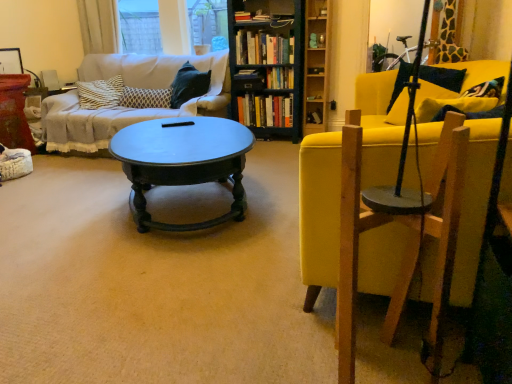
In order to face transparent glass window at upper center, should I rotate leftwards or rightwards?

Rotate your view left by about 10.457°.

What do you see at coordinates (140, 26) in the screenshot? Image resolution: width=512 pixels, height=384 pixels. I see `transparent glass window at upper center` at bounding box center [140, 26].

The height and width of the screenshot is (384, 512). Describe the element at coordinates (407, 242) in the screenshot. I see `wooden swivel chair at right` at that location.

What is the approximate height of wooden swivel chair at right?

wooden swivel chair at right is 30.66 inches in height.

Describe the element at coordinates (280, 78) in the screenshot. Image resolution: width=512 pixels, height=384 pixels. I see `hardcover book at center, which ranks as the fourth book in top-to-bottom order` at that location.

Locate an element on the screen. wooden bookshelf at center is located at coordinates (268, 66).

What do you see at coordinates (316, 65) in the screenshot? I see `wooden bookshelf at upper center` at bounding box center [316, 65].

The width and height of the screenshot is (512, 384). What are the coordinates of `wooden bookshelf at upper center` in the screenshot? It's located at (316, 65).

How much space does hardcover book at center, which appears as the second book when viewed from the top, occupy horizontally?

The width of hardcover book at center, which appears as the second book when viewed from the top, is 7.68 centimeters.

At what (x,y) coordinates should I click in order to perform the action: click on transparent glass window at upper center. Please return your answer as a coordinate pair (x, y). Looking at the image, I should click on (140, 26).

From a real-world perspective, is hardcover book at center, the 3th book ordered from the bottom, physically located above or below hardcover book at center, which is the fifth book from bottom to top?

In terms of real-world spatial position, hardcover book at center, the 3th book ordered from the bottom, is below hardcover book at center, which is the fifth book from bottom to top.

From the image's perspective, is hardcover book at center, the 3th book ordered from the bottom, beneath hardcover book at center, which is the fifth book from bottom to top?

Yes.

Choose the correct answer: Is hardcover book at center, which ranks as the fourth book in top-to-bottom order, inside hardcover book at center, which appears as the second book when viewed from the top, or outside it?

hardcover book at center, which ranks as the fourth book in top-to-bottom order, exists outside the volume of hardcover book at center, which appears as the second book when viewed from the top.

Which of these two, hardcover book at center, which ranks as the fourth book in top-to-bottom order, or hardcover book at center, which is the fifth book from bottom to top, is smaller?

hardcover book at center, which is the fifth book from bottom to top.

Between hardcover books at center, which is the 2th book from bottom to top, and hardcover book at center, which ranks as the fourth book in top-to-bottom order, which one has less height?

Standing shorter between the two is hardcover book at center, which ranks as the fourth book in top-to-bottom order.

In terms of width, does hardcover books at center, which is the 2th book from bottom to top, look wider or thinner when compared to hardcover book at center, the 3th book ordered from the bottom?

Considering their sizes, hardcover books at center, which is the 2th book from bottom to top, looks broader than hardcover book at center, the 3th book ordered from the bottom.

Which object is positioned more to the left, hardcover books at center, which is counted as the 5th book, starting from the top, or hardcover book at center, the 3th book ordered from the bottom?

From the viewer's perspective, hardcover books at center, which is counted as the 5th book, starting from the top, appears more on the left side.

Considering the sizes of hardcover books at center, which is the 2th book from bottom to top, and hardcover book at center, which ranks as the fourth book in top-to-bottom order, in the image, is hardcover books at center, which is the 2th book from bottom to top, bigger or smaller than hardcover book at center, which ranks as the fourth book in top-to-bottom order,?

Clearly, hardcover books at center, which is the 2th book from bottom to top, is larger in size than hardcover book at center, which ranks as the fourth book in top-to-bottom order.

Is shiny dark wood coffee table at center a part of patterned fabric pillow at center-left?

No, shiny dark wood coffee table at center is located outside of patterned fabric pillow at center-left.

In the scene shown: Is patterned fabric pillow at center-left next to shiny dark wood coffee table at center and touching it?

No, patterned fabric pillow at center-left is not in contact with shiny dark wood coffee table at center.

Between patterned fabric pillow at center-left and shiny dark wood coffee table at center, which one has smaller size?

patterned fabric pillow at center-left is smaller.

Would you consider hardcover book at center, which appears as the second book when viewed from the top, to be distant from wooden bookshelf at upper center?

No, hardcover book at center, which appears as the second book when viewed from the top, is not far from wooden bookshelf at upper center.

Which point is more distant from viewer, (314, 70) or (323, 86)?

Point (323, 86)

Considering the relative sizes of hardcover book at center, which appears as the second book when viewed from the top, and wooden bookshelf at upper center in the image provided, is hardcover book at center, which appears as the second book when viewed from the top, taller than wooden bookshelf at upper center?

No.

Is hardcover books at center, which is counted as the 6th book, starting from the bottom, facing towards white fabric curtain at upper left?

No, hardcover books at center, which is counted as the 6th book, starting from the bottom, is not aimed at white fabric curtain at upper left.

Between hardcover books at center, the first book from the top, and white fabric curtain at upper left, which one is positioned in front?

hardcover books at center, the first book from the top.

In the scene shown: Is hardcover books at center, the first book from the top, to the left of white fabric curtain at upper left from the viewer's perspective?

No.

Who is smaller, hardcover books at center, the first book from the top, or white fabric curtain at upper left?

Smaller between the two is hardcover books at center, the first book from the top.

Is hardcover books at center, which is the 2th book from bottom to top, at the right side of wooden bookshelf at center?

Incorrect, hardcover books at center, which is the 2th book from bottom to top, is not on the right side of wooden bookshelf at center.

Based on their sizes in the image, would you say hardcover books at center, which is the 2th book from bottom to top, is bigger or smaller than wooden bookshelf at center?

Clearly, hardcover books at center, which is the 2th book from bottom to top, is smaller in size than wooden bookshelf at center.

Identify the location of bookcase to the right of hardcover books at center, which is counted as the 5th book, starting from the top. (268, 66).

Would you say hardcover books at center, which is counted as the 5th book, starting from the top, is outside wooden bookshelf at center?

No, hardcover books at center, which is counted as the 5th book, starting from the top, is not outside of wooden bookshelf at center.

Is shiny dark wood coffee table at center surrounding wooden swivel chair at right?

Actually, wooden swivel chair at right is outside shiny dark wood coffee table at center.

Measure the distance from shiny dark wood coffee table at center to wooden swivel chair at right.

shiny dark wood coffee table at center and wooden swivel chair at right are 1.24 meters apart from each other.

Between shiny dark wood coffee table at center and wooden swivel chair at right, which one has less height?

shiny dark wood coffee table at center is shorter.

Can you confirm if shiny dark wood coffee table at center is bigger than wooden swivel chair at right?

Yes.

Locate an element on the screen. The width and height of the screenshot is (512, 384). book that is the 3rd object located in front of the hardcover book at center, which is the fifth book from bottom to top is located at coordinates (280, 78).

Identify the location of the 1st book to the right of the hardcover books at center, which is the 2th book from bottom to top, counting from the anchor's position. (280, 78).

From the picture: Looking at the image, which one is located closer to wooden bookshelf at upper center, velvet yellow chair at right or white fabric curtain at upper left?

Among the two, white fabric curtain at upper left is located nearer to wooden bookshelf at upper center.

Estimate the real-world distances between objects in this image. Which object is further from velvet yellow chair at right, wooden bookshelf at upper center or wooden bookshelf at center?

wooden bookshelf at upper center is positioned further to the anchor velvet yellow chair at right.

From the image, which object appears to be nearer to hardcover books at center, which is counted as the 5th book, starting from the top, white fabric curtain at upper left or hardcover books at center, the first book from the top?

Based on the image, hardcover books at center, the first book from the top, appears to be nearer to hardcover books at center, which is counted as the 5th book, starting from the top.

From the image, which object appears to be farther from transparent glass window at upper center, shiny dark wood coffee table at center or wooden swivel chair at right?

wooden swivel chair at right.

Estimate the real-world distances between objects in this image. Which object is further from hardcover book at center, which is the fifth book from bottom to top, velvet yellow chair at right or wooden bookshelf at upper center?

velvet yellow chair at right is further to hardcover book at center, which is the fifth book from bottom to top.

Based on the photo, from the image, which object appears to be nearer to hardcover book at center, the 3th book ordered from the bottom, hardcover book at center, which is counted as the third book, starting from the top, or hardcover books at center, which is counted as the 6th book, starting from the bottom?

Among the two, hardcover book at center, which is counted as the third book, starting from the top, is located nearer to hardcover book at center, the 3th book ordered from the bottom.

From the image, which object appears to be farther from matte black book at center, acting as the first book starting from the bottom, wooden swivel chair at right or transparent glass window at upper center?

The object further to matte black book at center, acting as the first book starting from the bottom, is wooden swivel chair at right.

Based on their spatial positions, is wooden bookshelf at upper center or white fabric curtain at upper left closer to patterned fabric pillow at center-left?

white fabric curtain at upper left is positioned closer to the anchor patterned fabric pillow at center-left.

Where is `bookcase between white fabric curtain at upper left and hardcover book at center, which appears as the second book when viewed from the top, in the horizontal direction`? This screenshot has height=384, width=512. bookcase between white fabric curtain at upper left and hardcover book at center, which appears as the second book when viewed from the top, in the horizontal direction is located at coordinates (268, 66).

You are a GUI agent. You are given a task and a screenshot of the screen. Output one action in this format:
    pyautogui.click(x=<x>, y=<y>)
    Task: Click on the book between wooden bookshelf at center and hardcover book at center, which is the fifth book from bottom to top, in the horizontal direction
    
    Given the screenshot: What is the action you would take?
    pyautogui.click(x=280, y=78)

This screenshot has height=384, width=512. Identify the location of window screen positioned between velvet yellow chair at right and white fabric curtain at upper left from near to far. (140, 26).

In order to click on shelf positioned between shiny dark wood coffee table at center and transparent glass window at upper center from near to far in this screenshot , I will do `click(316, 65)`.